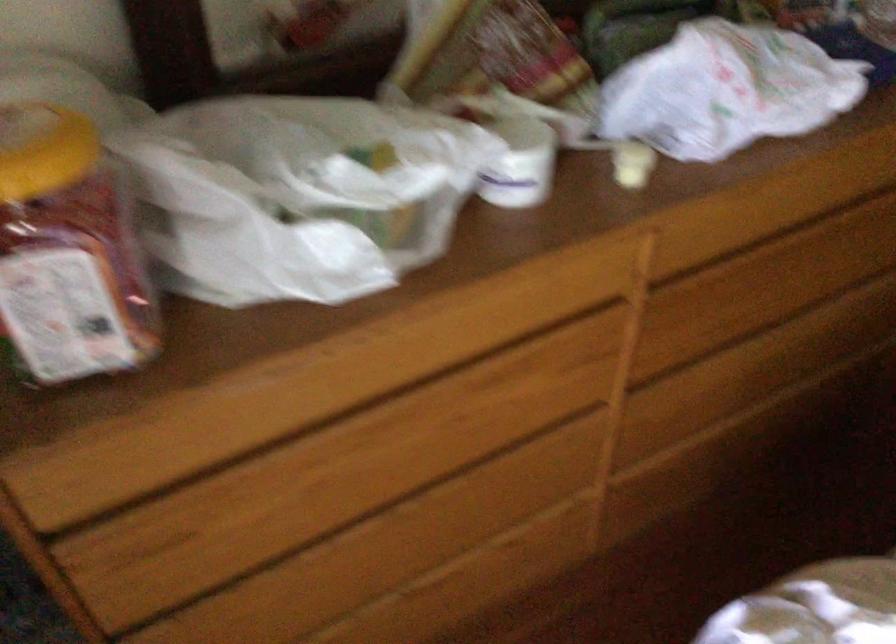
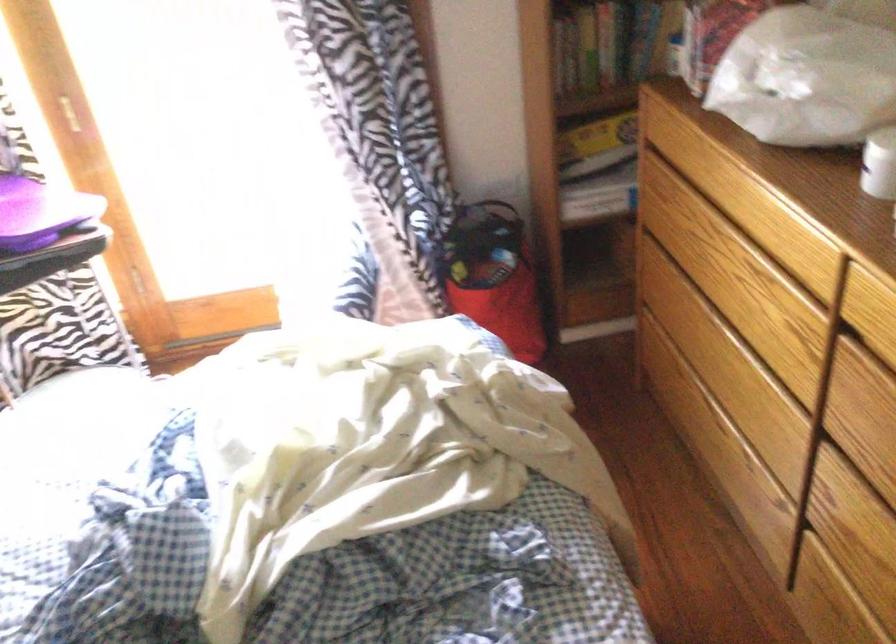
Find the pixel in the second image that matches [688,353] in the first image.

(868, 460)